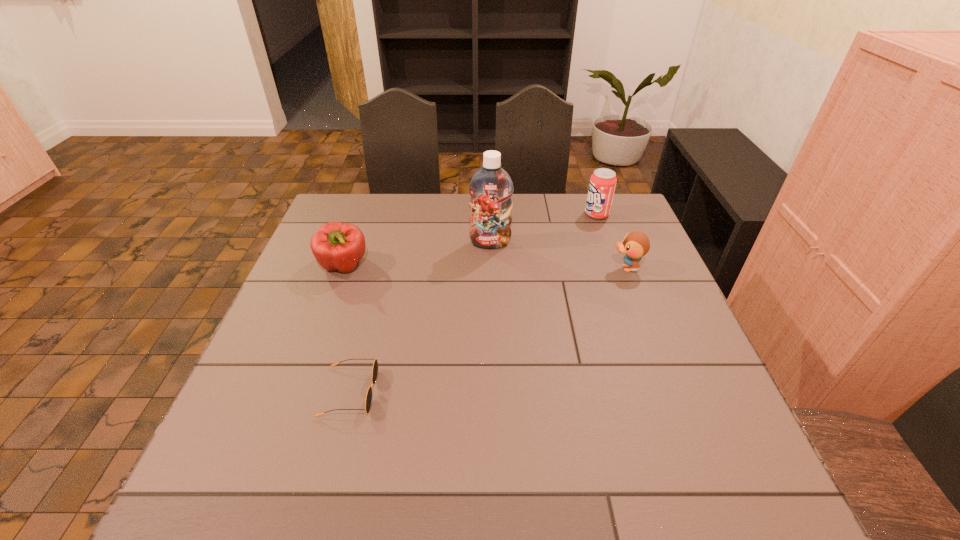
Find the location of a particular element. The height and width of the screenshot is (540, 960). object that is at the far right corner is located at coordinates (603, 181).

Locate an element on the screen. free space at the far edge of the desktop is located at coordinates (463, 198).

Identify the location of free space at the left edge of the desktop. (310, 261).

The height and width of the screenshot is (540, 960). Find the location of `vacant area at the right edge`. vacant area at the right edge is located at coordinates (640, 293).

What are the coordinates of `empty location between the bell pepper and the duck` in the screenshot? It's located at (485, 267).

Where is `vacant space in between the nearest object and the bell pepper`? The width and height of the screenshot is (960, 540). vacant space in between the nearest object and the bell pepper is located at coordinates (347, 329).

The width and height of the screenshot is (960, 540). What are the coordinates of `free space between the bell pepper and the duck` in the screenshot? It's located at (485, 267).

At what (x,y) coordinates should I click in order to perform the action: click on vacant area that lies between the third object from left to right and the soda can. Please return your answer as a coordinate pair (x, y). The width and height of the screenshot is (960, 540). Looking at the image, I should click on (543, 228).

Find the location of a particular element. The image size is (960, 540). vacant point located between the nearest object and the duck is located at coordinates (488, 330).

Identify the location of vacant space that's between the farthest object and the shampoo. (543, 228).